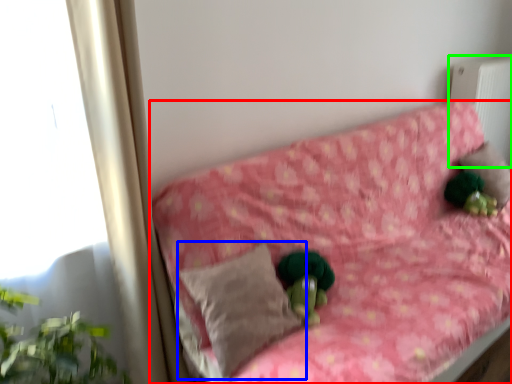
Question: Which object is the closest to the furniture (highlighted by a red box)? Choose among these: pillow (highlighted by a blue box) or radiator (highlighted by a green box).

Choices:
 (A) pillow
 (B) radiator

Answer: (A)